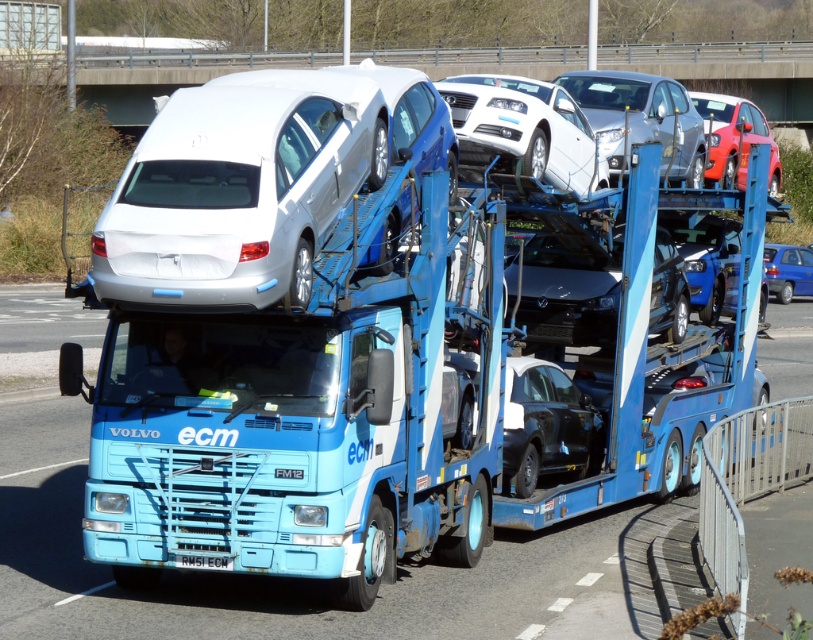
You are standing at the point marked by the coordinates point (524, 129) on the blue Volvo car transporter truck. Looking around, you see the white glossy sedan at upper center. Which direction should you face to see the white glossy sedan at upper center?

You are already at the point marked by the coordinates point (524, 129), which marks the white glossy sedan at upper center. Therefore, you are already facing the white glossy sedan at upper center.

What are the coordinates of the satin silver car at center?

The satin silver car at center is located at coordinates point (259, 182).

Consider the image. You are a delivery driver who needs to park your truck under a low bridge. The bridge has a height restriction sign indicating a maximum height of 4 meters. You observe the blue metallic truck at center and the white glossy sedan at upper center. Can you safely pass under the bridge with your truck?

The blue metallic truck at center is much taller than the white glossy sedan at upper center. Since the bridge has a maximum height of 4 meters, the truck may not be able to pass safely if its height exceeds the limit. However, without knowing the exact height of the truck, we cannot confirm if it will fit under the bridge.